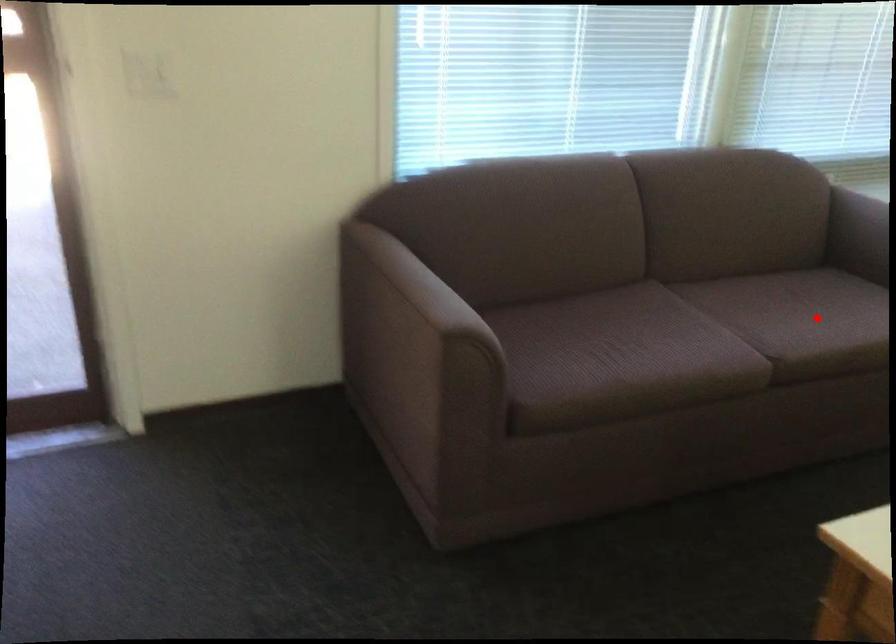
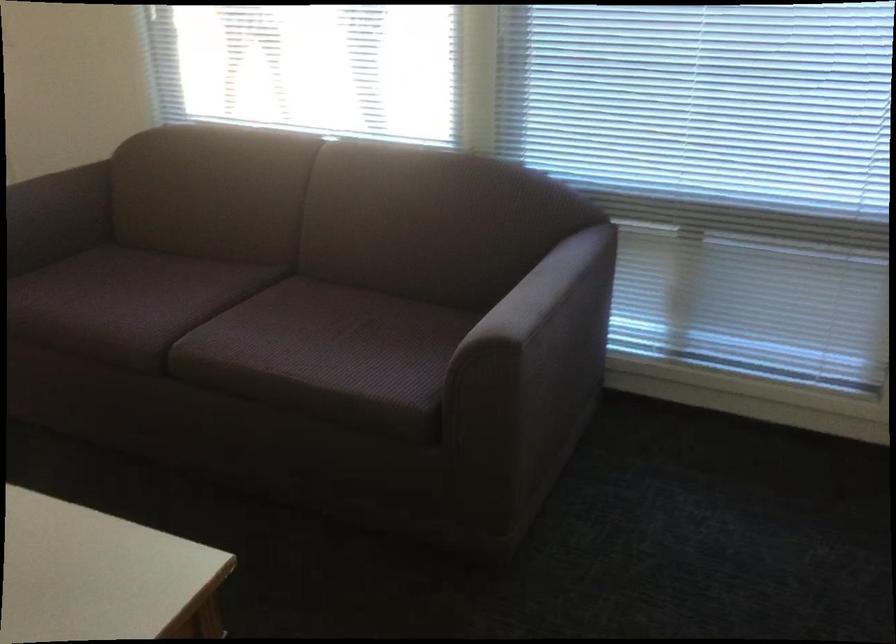
The point at the highlighted location is marked in the first image. Where is the corresponding point in the second image?

(325, 346)